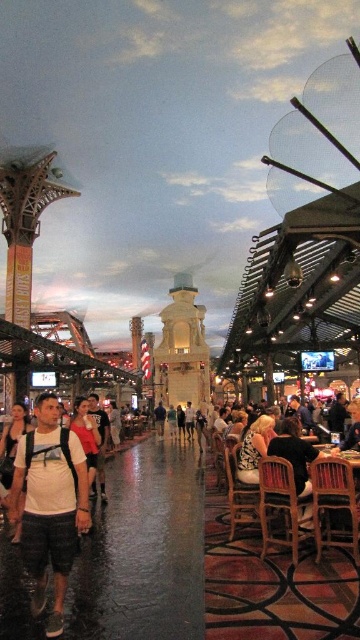
From the picture: You are a photographer standing in the marketplace and want to capture both the white cotton shirt at center and the matte black backpack at center in a single photo. Considering their sizes, which object should you focus on to ensure both are clearly visible in the frame?

The white cotton shirt at center has a smaller size compared to the matte black backpack at center. To ensure both are clearly visible, focus on the matte black backpack at center since it is larger and will remain in focus even if the shirt is slightly smaller in the frame.